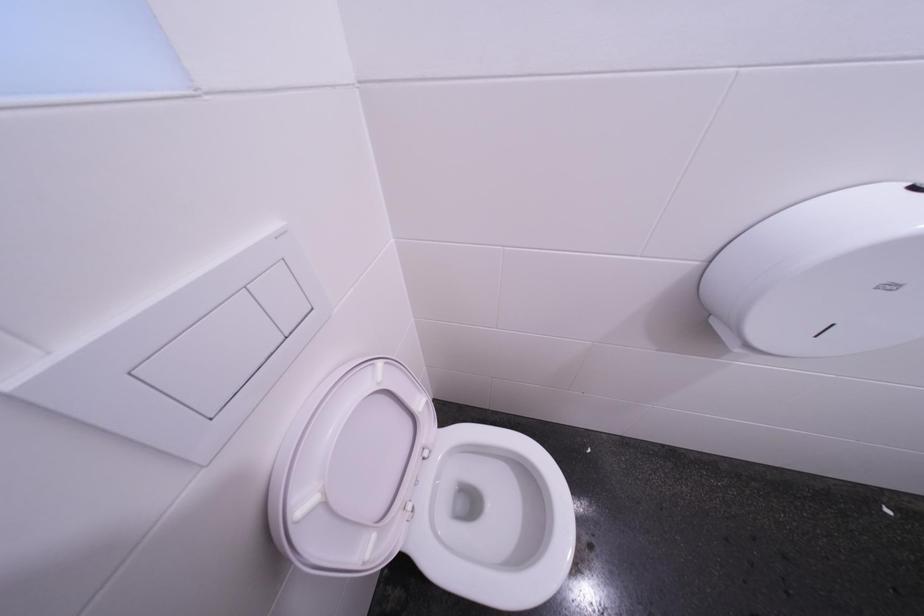
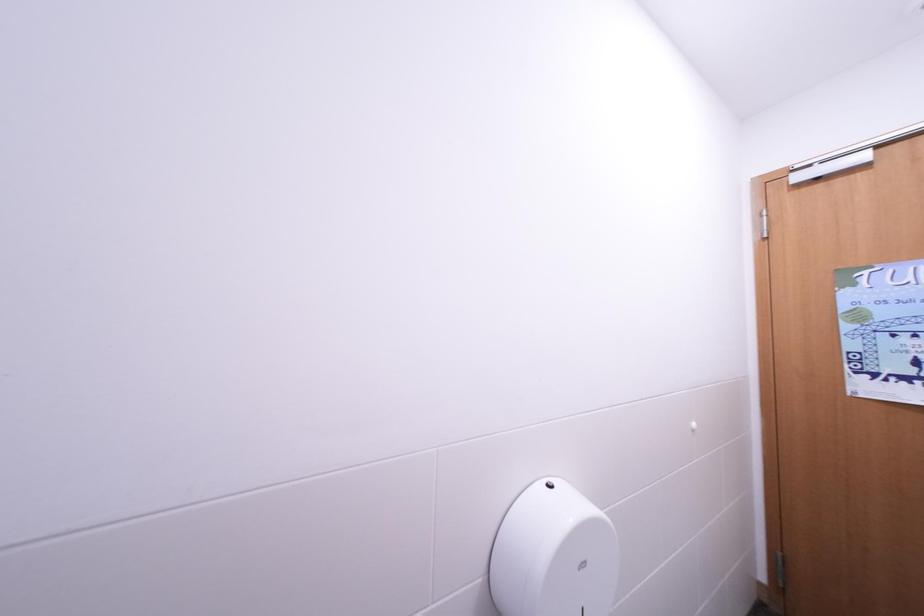
First-person continuous shooting, in which direction is the camera rotating?

The camera's rotation is toward right-up.